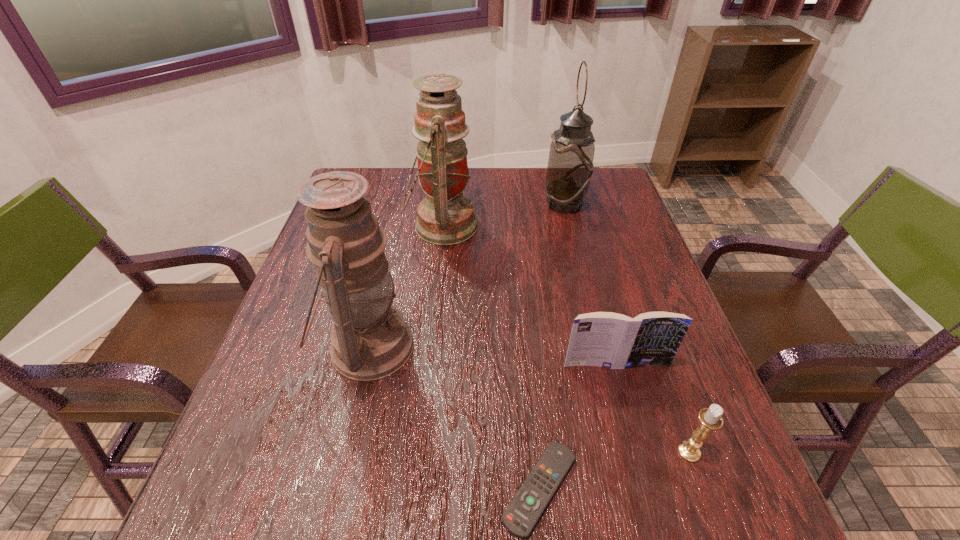
Where is `vacant space at the right edge of the desktop`? This screenshot has width=960, height=540. vacant space at the right edge of the desktop is located at coordinates (608, 303).

This screenshot has width=960, height=540. In the image, there is a desktop. In order to click on vacant space at the far left corner in this screenshot , I will do `click(373, 200)`.

You are a GUI agent. You are given a task and a screenshot of the screen. Output one action in this format:
    pyautogui.click(x=<x>, y=<y>)
    Task: Click on the free location at the near right corner of the desktop
    The image size is (960, 540).
    Given the screenshot: What is the action you would take?
    pyautogui.click(x=729, y=531)

The image size is (960, 540). What are the coordinates of `vacant point located between the rightmost oil lamp and the fourth object from right to left` in the screenshot? It's located at (552, 346).

Locate an element on the screen. This screenshot has height=540, width=960. free space between the book and the nearest oil lamp is located at coordinates (492, 355).

Find the location of a particular element. The width and height of the screenshot is (960, 540). unoccupied area between the nearest oil lamp and the candle holder is located at coordinates (529, 399).

At what (x,y) coordinates should I click in order to perform the action: click on free space between the shortest object and the nearest oil lamp. Please return your answer as a coordinate pair (x, y). This screenshot has height=540, width=960. Looking at the image, I should click on [x=454, y=417].

This screenshot has width=960, height=540. I want to click on free space between the shortest object and the book, so click(578, 426).

I want to click on free spot between the candle holder and the nearest oil lamp, so click(x=529, y=399).

Locate an element on the screen. empty space between the rightmost oil lamp and the book is located at coordinates (590, 284).